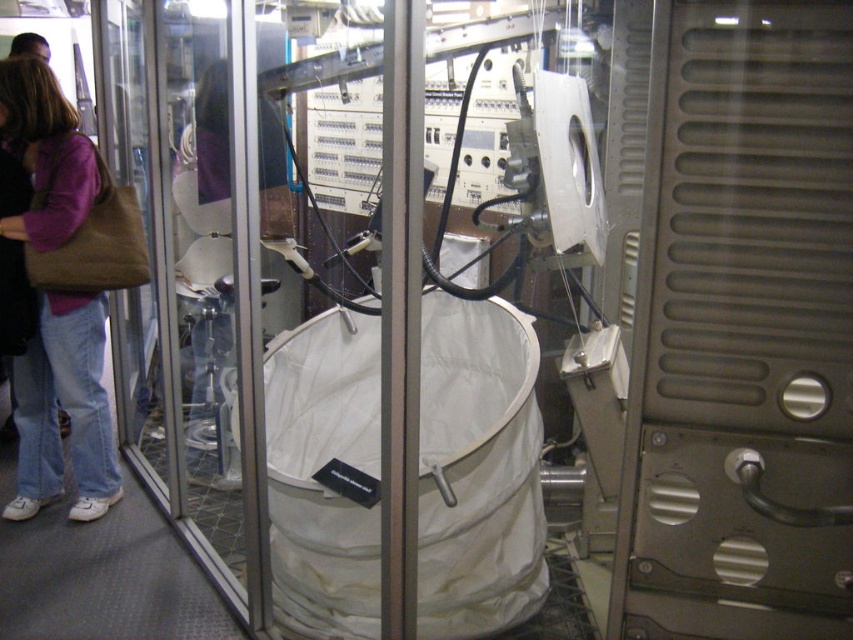
Which is in front, point (253, 417) or point (96, 342)?

Point (253, 417) is in front.

What are the coordinates of `transparent glass screen door at left` in the screenshot? It's located at (198, 269).